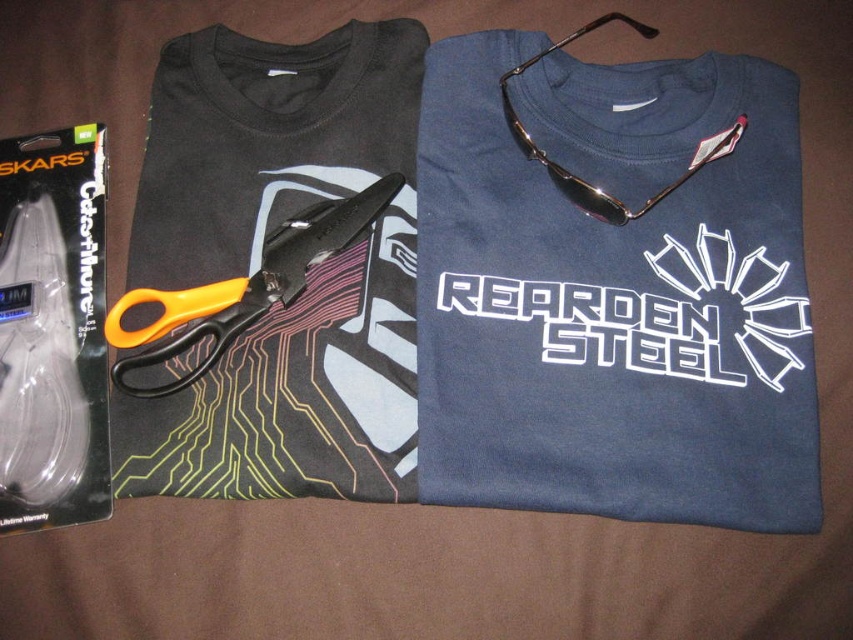
Can you confirm if dark blue cotton t-shirt at upper center is wider than metallic gold sunglasses at upper center?

Yes, dark blue cotton t-shirt at upper center is wider than metallic gold sunglasses at upper center.

Does dark blue cotton t-shirt at upper center appear over metallic gold sunglasses at upper center?

Actually, dark blue cotton t-shirt at upper center is below metallic gold sunglasses at upper center.

Which is in front, point (810, 436) or point (514, 74)?

Positioned in front is point (810, 436).

You are a GUI agent. You are given a task and a screenshot of the screen. Output one action in this format:
    pyautogui.click(x=<x>, y=<y>)
    Task: Click on the dark blue cotton t-shirt at upper center
    This screenshot has width=853, height=640.
    Given the screenshot: What is the action you would take?
    pyautogui.click(x=613, y=292)

Is white glossy text at center smaller than metallic gold sunglasses at upper center?

Yes.

Is point (669, 356) farther from viewer compared to point (505, 118)?

No, it is in front of (505, 118).

Where is `white glossy text at center`? The width and height of the screenshot is (853, 640). white glossy text at center is located at coordinates (599, 323).

Locate an element on the screen. The height and width of the screenshot is (640, 853). white glossy text at center is located at coordinates (599, 323).

Image resolution: width=853 pixels, height=640 pixels. What do you see at coordinates (613, 292) in the screenshot?
I see `dark blue cotton t-shirt at upper center` at bounding box center [613, 292].

Can you confirm if dark blue cotton t-shirt at upper center is positioned to the left of white glossy text at center?

In fact, dark blue cotton t-shirt at upper center is to the right of white glossy text at center.

Image resolution: width=853 pixels, height=640 pixels. What do you see at coordinates (613, 292) in the screenshot? I see `dark blue cotton t-shirt at upper center` at bounding box center [613, 292].

Identify the location of dark blue cotton t-shirt at upper center. The image size is (853, 640). (613, 292).